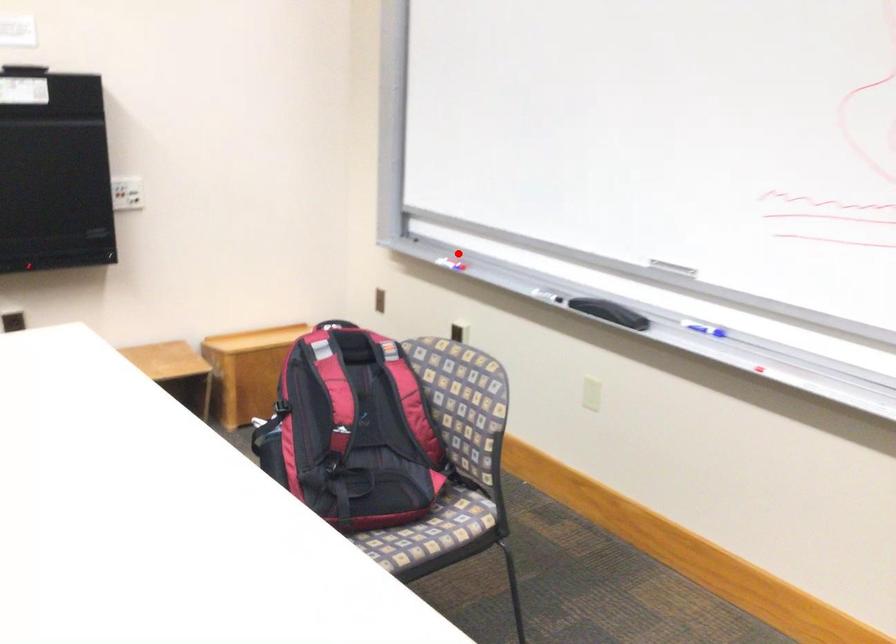
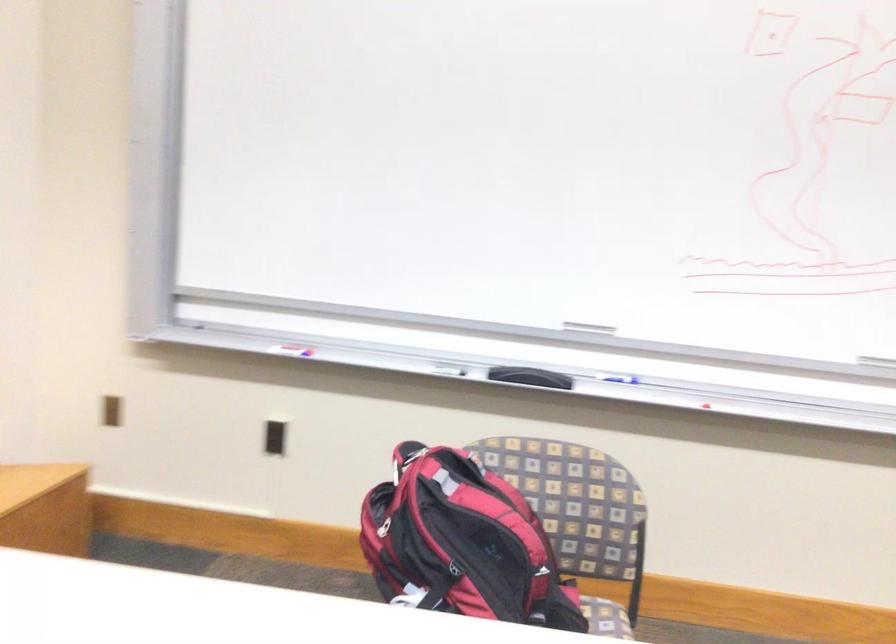
Locate, in the second image, the point that corresponds to the highlighted location in the first image.

(288, 345)